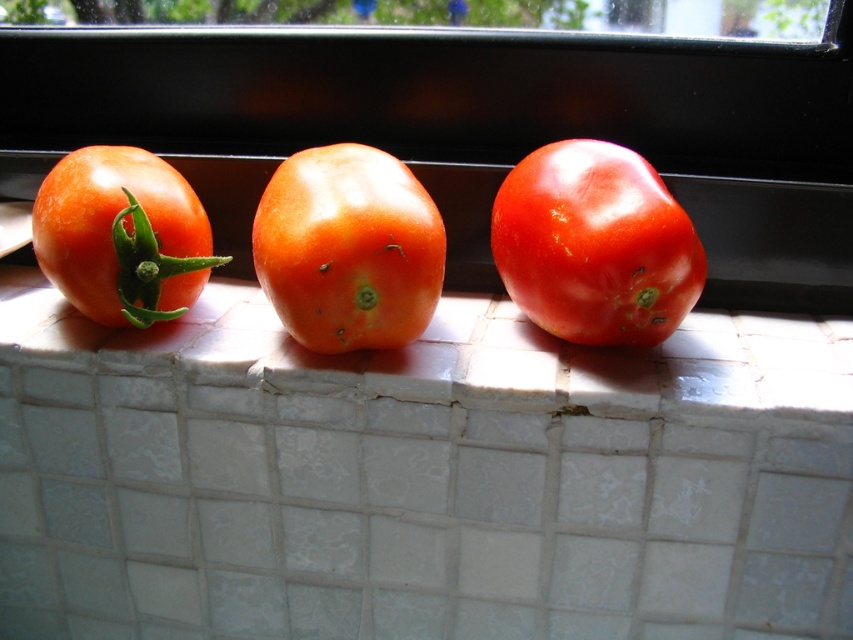
You are a gardener who wants to place a new tomato plant in the windowsill. The existing tomatoes are on the tiles. If you want to place the new plant so it gets the most sunlight, where should you position it relative to the glossy orange tomato at center?

The glossy orange tomato at center is located at point [347,248]. Since the tomatoes are positioned in front of a window with light coming from behind, the best spot for maximum sunlight would be to the side of the glossy orange tomato at center where there is less shadow. However, without specific spatial relations to other objects, the safest placement would be next to it but ensuring it is not blocked by the existing tomatoes.

You are standing in front of a windowsill with three tomatoes. You want to pick up the glossy red tomato at center. Where exactly should you reach to grab it?

The glossy red tomato at center is located at point (595, 244), so you should reach there to grab it.